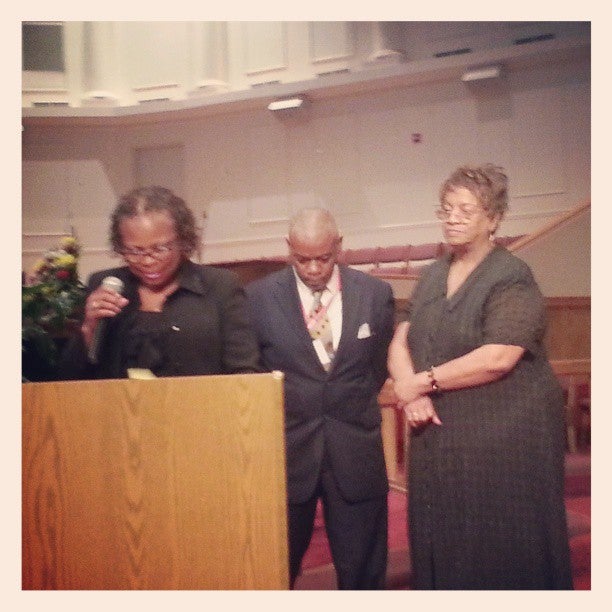
The height and width of the screenshot is (612, 612). In order to click on lectern in this screenshot , I will do `click(195, 430)`.